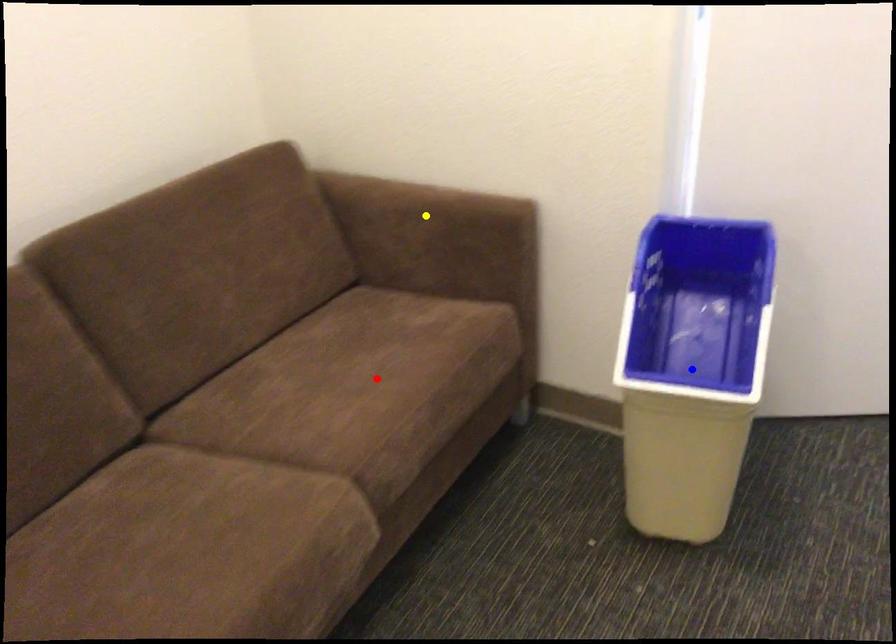
Order these from nearest to farthest:
yellow point | blue point | red point

red point
blue point
yellow point